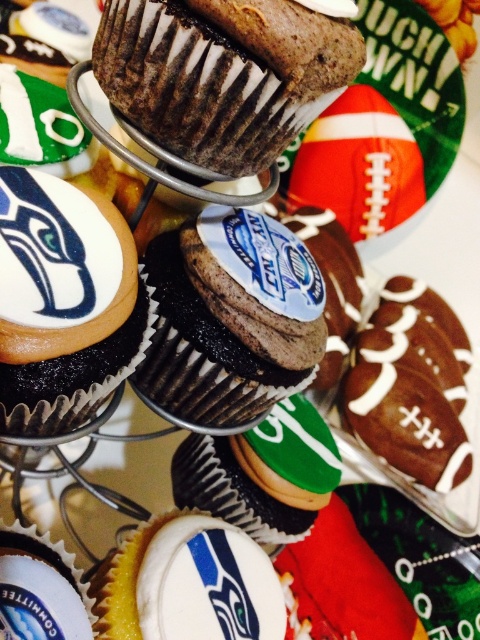
You are planning to serve these cupcakes at a sports party and want to choose the bigger one between the chocolatesmoothcupcake at center and the chocolate frosted cupcake at center. Which one should you pick?

The chocolatesmoothcupcake at center is larger in size compared to the chocolate frosted cupcake at center, so you should pick the chocolatesmoothcupcake at center.

You are looking at the cupcakes on the cooling rack and notice two points marked on the image. The first point is at coordinates point (91, 404) and the second is at point (27, 589). Which point is closer to you?

Point (91, 404) is further to the camera than point (27, 589). Therefore, point (27, 589) is closer to you.

You are a baker checking the height of cupcakes on a cooling rack. You see a matte chocolate cupcake at center and a white glossy cupcake at center. Which one is taller?

The matte chocolate cupcake at center is taller than the white glossy cupcake at center.